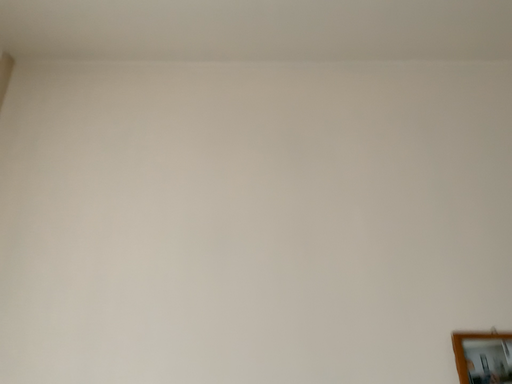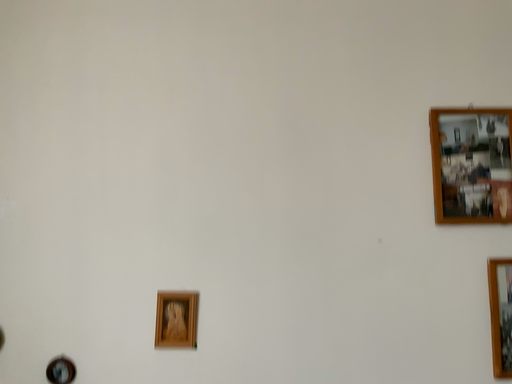
Question: Which way did the camera rotate in the video?

Choices:
 (A) rotated downward
 (B) rotated upward

Answer: (A)